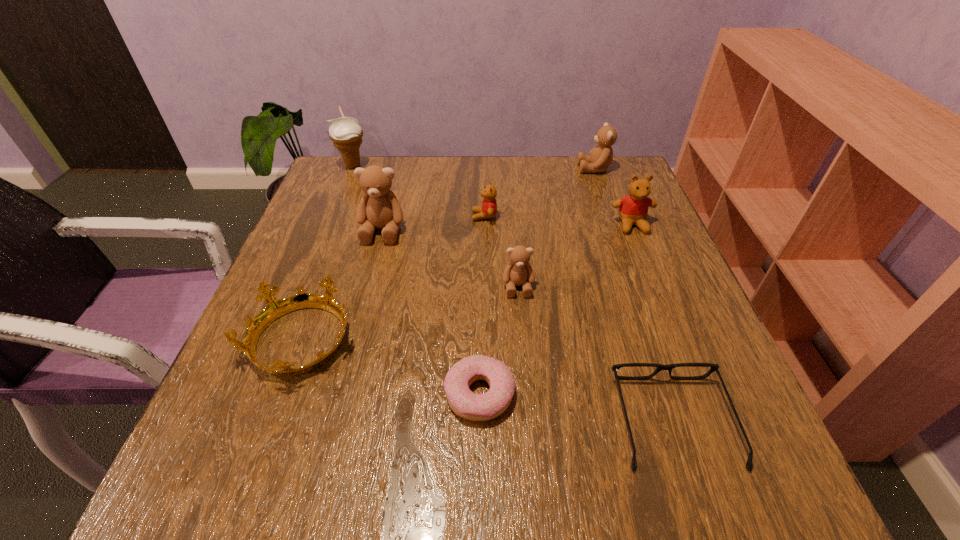
Identify the location of icecream. (346, 133).

The width and height of the screenshot is (960, 540). I want to click on the leftmost brown teddy bear, so click(x=379, y=208).

The width and height of the screenshot is (960, 540). In order to click on the second farthest brown teddy bear in this screenshot , I will do `click(379, 208)`.

Where is `the second smallest brown teddy bear`? The image size is (960, 540). the second smallest brown teddy bear is located at coordinates (600, 157).

The height and width of the screenshot is (540, 960). I want to click on the farthest teddy bear, so click(x=600, y=157).

Find the location of a particular element. This screenshot has height=540, width=960. the right red teddy bear is located at coordinates (633, 209).

This screenshot has width=960, height=540. I want to click on the left red teddy bear, so click(x=488, y=210).

At what (x,y) coordinates should I click in order to perform the action: click on the second teddy bear from left to right. Please return your answer as a coordinate pair (x, y). The image size is (960, 540). Looking at the image, I should click on 488,210.

The image size is (960, 540). In order to click on the smallest brown teddy bear in this screenshot , I will do `click(518, 272)`.

The height and width of the screenshot is (540, 960). Find the location of `the nearest brown teddy bear`. the nearest brown teddy bear is located at coordinates (518, 272).